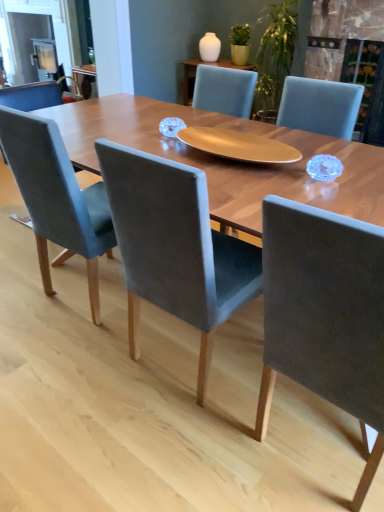
Measure the distance between velvet grey chair at center, marked as the second chair in a left-to-right arrangement, and camera.

They are 3.46 feet apart.

I want to click on velvet grey chair at left, the 1th chair when ordered from left to right, so click(x=57, y=198).

Where is `suede-like gray chair at center, positioned as the third chair in left-to-right order`? Image resolution: width=384 pixels, height=512 pixels. suede-like gray chair at center, positioned as the third chair in left-to-right order is located at coordinates (324, 314).

Is point (68, 185) closer or farther from the camera than point (235, 251)?

Clearly, point (68, 185) is closer to the camera than point (235, 251).

Is velvet grey chair at left, acting as the 3th chair starting from the right, oriented away from velvet grey chair at center, marked as the second chair in a right-to-left arrangement?

No, velvet grey chair at left, acting as the 3th chair starting from the right,'s orientation is not away from velvet grey chair at center, marked as the second chair in a right-to-left arrangement.

Visually, is velvet grey chair at left, the 1th chair when ordered from left to right, positioned to the left or to the right of velvet grey chair at center, marked as the second chair in a right-to-left arrangement?

From the image, it's evident that velvet grey chair at left, the 1th chair when ordered from left to right, is to the left of velvet grey chair at center, marked as the second chair in a right-to-left arrangement.

Is velvet grey chair at left, acting as the 3th chair starting from the right, inside or outside of suede-like gray chair at center, the 1th chair in the right-to-left sequence?

velvet grey chair at left, acting as the 3th chair starting from the right, cannot be found inside suede-like gray chair at center, the 1th chair in the right-to-left sequence.

Does velvet grey chair at left, the 1th chair when ordered from left to right, have a larger size compared to suede-like gray chair at center, the 1th chair in the right-to-left sequence?

Indeed, velvet grey chair at left, the 1th chair when ordered from left to right, has a larger size compared to suede-like gray chair at center, the 1th chair in the right-to-left sequence.

Looking at this image, how many degrees apart are the facing directions of velvet grey chair at left, the 1th chair when ordered from left to right, and suede-like gray chair at center, the 1th chair in the right-to-left sequence?

The facing directions of velvet grey chair at left, the 1th chair when ordered from left to right, and suede-like gray chair at center, the 1th chair in the right-to-left sequence, are 0.000345 degrees apart.

From the image's perspective, is velvet grey chair at left, the 1th chair when ordered from left to right, on suede-like gray chair at center, positioned as the third chair in left-to-right order?

Yes.

Is velvet grey chair at center, marked as the second chair in a right-to-left arrangement, to the left or to the right of suede-like gray chair at center, the 1th chair in the right-to-left sequence, in the image?

In the image, velvet grey chair at center, marked as the second chair in a right-to-left arrangement, appears on the left side of suede-like gray chair at center, the 1th chair in the right-to-left sequence.

In the scene shown: Which of these two, velvet grey chair at center, marked as the second chair in a right-to-left arrangement, or suede-like gray chair at center, positioned as the third chair in left-to-right order, is wider?

With larger width is suede-like gray chair at center, positioned as the third chair in left-to-right order.

Is velvet grey chair at center, marked as the second chair in a right-to-left arrangement, outside of suede-like gray chair at center, positioned as the third chair in left-to-right order?

Indeed, velvet grey chair at center, marked as the second chair in a right-to-left arrangement, is completely outside suede-like gray chair at center, positioned as the third chair in left-to-right order.

You are a GUI agent. You are given a task and a screenshot of the screen. Output one action in this format:
    pyautogui.click(x=<x>, y=<y>)
    Task: Click on the chair on the right of velvet grey chair at center, marked as the second chair in a left-to-right arrangement
    
    Given the screenshot: What is the action you would take?
    tap(324, 314)

Between suede-like gray chair at center, positioned as the third chair in left-to-right order, and velvet grey chair at center, marked as the second chair in a right-to-left arrangement, which one appears on the left side from the viewer's perspective?

velvet grey chair at center, marked as the second chair in a right-to-left arrangement.

Based on the photo, considering the relative sizes of suede-like gray chair at center, positioned as the third chair in left-to-right order, and velvet grey chair at center, marked as the second chair in a left-to-right arrangement, in the image provided, is suede-like gray chair at center, positioned as the third chair in left-to-right order, smaller than velvet grey chair at center, marked as the second chair in a left-to-right arrangement,?

No, suede-like gray chair at center, positioned as the third chair in left-to-right order, is not smaller than velvet grey chair at center, marked as the second chair in a left-to-right arrangement.

There is a suede-like gray chair at center, the 1th chair in the right-to-left sequence. Where is `the 2nd chair above it (from the image's perspective)`? the 2nd chair above it (from the image's perspective) is located at coordinates (x=57, y=198).

Looking at this image, measure the distance between suede-like gray chair at center, the 1th chair in the right-to-left sequence, and velvet grey chair at left, acting as the 3th chair starting from the right.

suede-like gray chair at center, the 1th chair in the right-to-left sequence, and velvet grey chair at left, acting as the 3th chair starting from the right, are 3.38 feet apart.

From the image's perspective, would you say suede-like gray chair at center, the 1th chair in the right-to-left sequence, is shown under velvet grey chair at left, acting as the 3th chair starting from the right?

Indeed, from the image's perspective, suede-like gray chair at center, the 1th chair in the right-to-left sequence, is shown beneath velvet grey chair at left, acting as the 3th chair starting from the right.

Which object is wider, suede-like gray chair at center, the 1th chair in the right-to-left sequence, or velvet grey chair at left, acting as the 3th chair starting from the right?

velvet grey chair at left, acting as the 3th chair starting from the right.

Looking at this image, from their relative heights in the image, would you say velvet grey chair at center, marked as the second chair in a left-to-right arrangement, is taller or shorter than velvet grey chair at left, the 1th chair when ordered from left to right?

In the image, velvet grey chair at center, marked as the second chair in a left-to-right arrangement, appears to be shorter than velvet grey chair at left, the 1th chair when ordered from left to right.

Considering the relative positions of velvet grey chair at center, marked as the second chair in a left-to-right arrangement, and velvet grey chair at left, the 1th chair when ordered from left to right, in the image provided, is velvet grey chair at center, marked as the second chair in a left-to-right arrangement, to the left of velvet grey chair at left, the 1th chair when ordered from left to right, from the viewer's perspective?

Incorrect, velvet grey chair at center, marked as the second chair in a left-to-right arrangement, is not on the left side of velvet grey chair at left, the 1th chair when ordered from left to right.

Are velvet grey chair at center, marked as the second chair in a left-to-right arrangement, and velvet grey chair at left, acting as the 3th chair starting from the right, located far from each other?

No, there isn't a large distance between velvet grey chair at center, marked as the second chair in a left-to-right arrangement, and velvet grey chair at left, acting as the 3th chair starting from the right.

From a real-world perspective, between velvet grey chair at center, marked as the second chair in a right-to-left arrangement, and velvet grey chair at left, acting as the 3th chair starting from the right, who is vertically higher?

In real-world perspective, velvet grey chair at center, marked as the second chair in a right-to-left arrangement, is above.

Identify the location of chair that is the 1st one when counting rightward from the velvet grey chair at left, acting as the 3th chair starting from the right. Image resolution: width=384 pixels, height=512 pixels. (175, 246).

Where is `chair that is the 2nd object located in front of the velvet grey chair at left, acting as the 3th chair starting from the right`? Image resolution: width=384 pixels, height=512 pixels. chair that is the 2nd object located in front of the velvet grey chair at left, acting as the 3th chair starting from the right is located at coordinates 324,314.

Which object lies further to the anchor point velvet grey chair at center, marked as the second chair in a left-to-right arrangement, suede-like gray chair at center, the 1th chair in the right-to-left sequence, or velvet grey chair at left, the 1th chair when ordered from left to right?

velvet grey chair at left, the 1th chair when ordered from left to right, is further to velvet grey chair at center, marked as the second chair in a left-to-right arrangement.

Estimate the real-world distances between objects in this image. Which object is further from velvet grey chair at left, acting as the 3th chair starting from the right, suede-like gray chair at center, the 1th chair in the right-to-left sequence, or velvet grey chair at center, marked as the second chair in a right-to-left arrangement?

The object further to velvet grey chair at left, acting as the 3th chair starting from the right, is suede-like gray chair at center, the 1th chair in the right-to-left sequence.

When comparing their distances from suede-like gray chair at center, positioned as the third chair in left-to-right order, does velvet grey chair at left, the 1th chair when ordered from left to right, or velvet grey chair at center, marked as the second chair in a right-to-left arrangement, seem closer?

velvet grey chair at center, marked as the second chair in a right-to-left arrangement.

Consider the image. Which object lies further to the anchor point velvet grey chair at center, marked as the second chair in a left-to-right arrangement, velvet grey chair at left, the 1th chair when ordered from left to right, or suede-like gray chair at center, positioned as the third chair in left-to-right order?

Based on the image, velvet grey chair at left, the 1th chair when ordered from left to right, appears to be further to velvet grey chair at center, marked as the second chair in a left-to-right arrangement.

Considering their positions, is velvet grey chair at center, marked as the second chair in a right-to-left arrangement, positioned closer to suede-like gray chair at center, the 1th chair in the right-to-left sequence, than velvet grey chair at left, acting as the 3th chair starting from the right?

velvet grey chair at center, marked as the second chair in a right-to-left arrangement, is positioned closer to the anchor suede-like gray chair at center, the 1th chair in the right-to-left sequence.

Looking at the image, which one is located further to velvet grey chair at left, the 1th chair when ordered from left to right, velvet grey chair at center, marked as the second chair in a left-to-right arrangement, or suede-like gray chair at center, the 1th chair in the right-to-left sequence?

The object further to velvet grey chair at left, the 1th chair when ordered from left to right, is suede-like gray chair at center, the 1th chair in the right-to-left sequence.

Locate an element on the screen. The height and width of the screenshot is (512, 384). chair between velvet grey chair at left, acting as the 3th chair starting from the right, and suede-like gray chair at center, the 1th chair in the right-to-left sequence, in the horizontal direction is located at coordinates (175, 246).